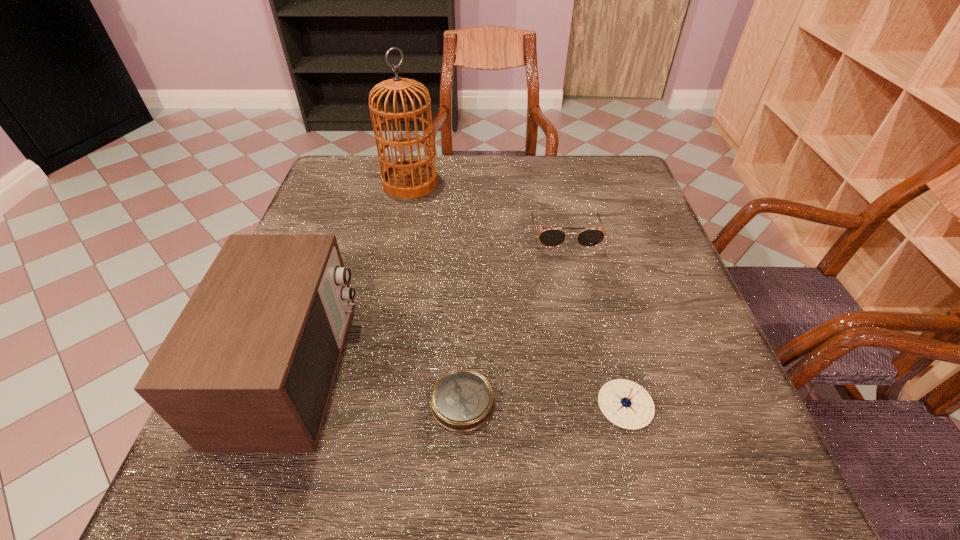
Where is `vacant space that satisfies the following two spatial constraints: 1. on the front-facing side of the second tallest object; 2. on the right side of the left compass`? The height and width of the screenshot is (540, 960). vacant space that satisfies the following two spatial constraints: 1. on the front-facing side of the second tallest object; 2. on the right side of the left compass is located at coordinates (281, 402).

Identify the location of vacant space that satisfies the following two spatial constraints: 1. on the front lenses of the fourth nearest object; 2. on the front-facing side of the radio receiver. (592, 369).